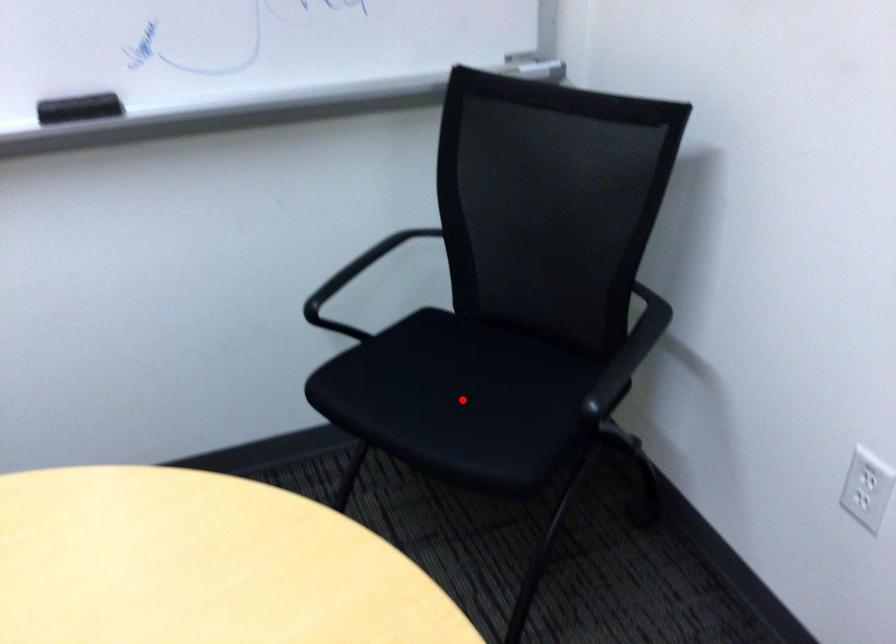
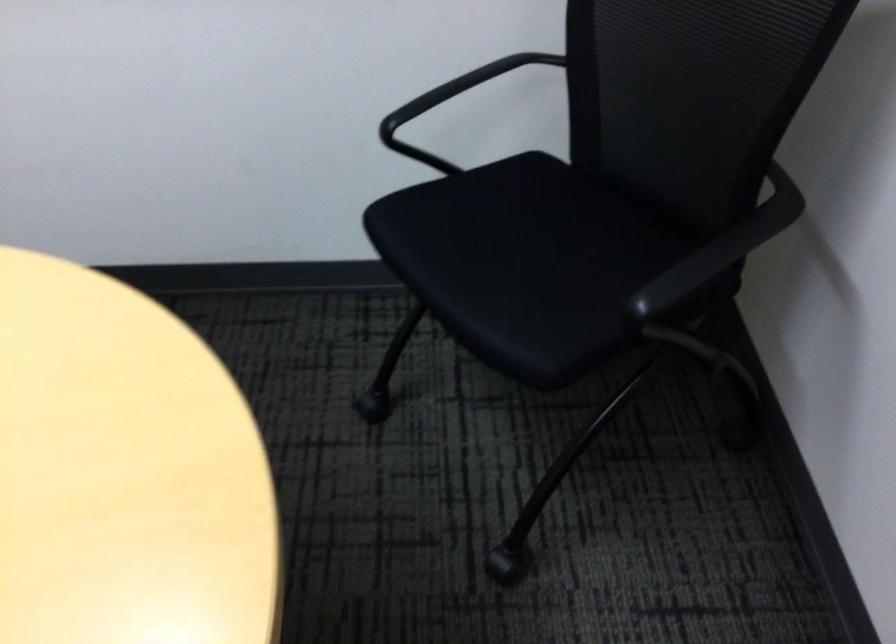
Locate, in the second image, the point that corresponds to the highlighted location in the first image.

(530, 269)